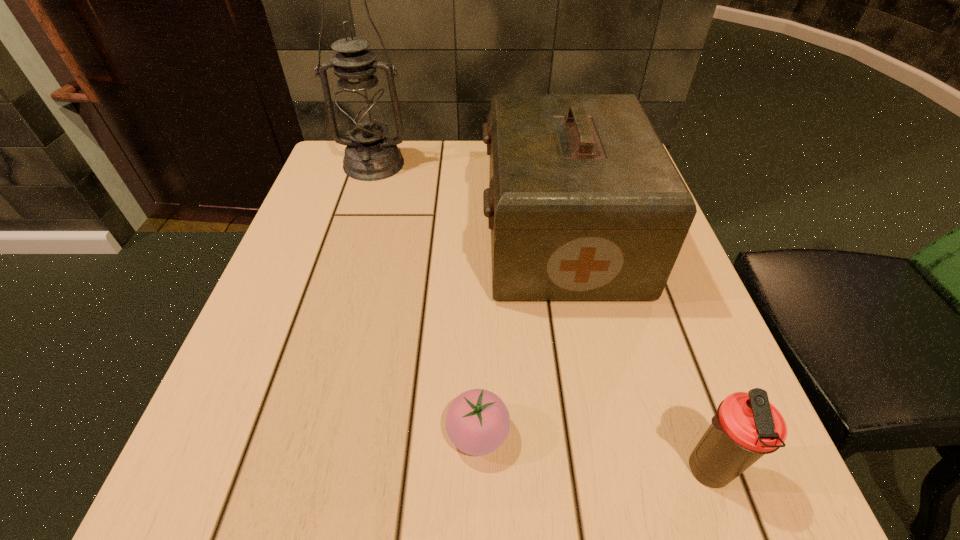
Where is `vacant space that satisfies the following two spatial constraints: 1. on the front side of the farthest object; 2. on the right side of the second farthest object`? vacant space that satisfies the following two spatial constraints: 1. on the front side of the farthest object; 2. on the right side of the second farthest object is located at coordinates (351, 238).

At what (x,y) coordinates should I click in order to perform the action: click on free spot that satisfies the following two spatial constraints: 1. on the front side of the thermos bottle; 2. on the right side of the third shortest object. Please return your answer as a coordinate pair (x, y). The image size is (960, 540). Looking at the image, I should click on (605, 470).